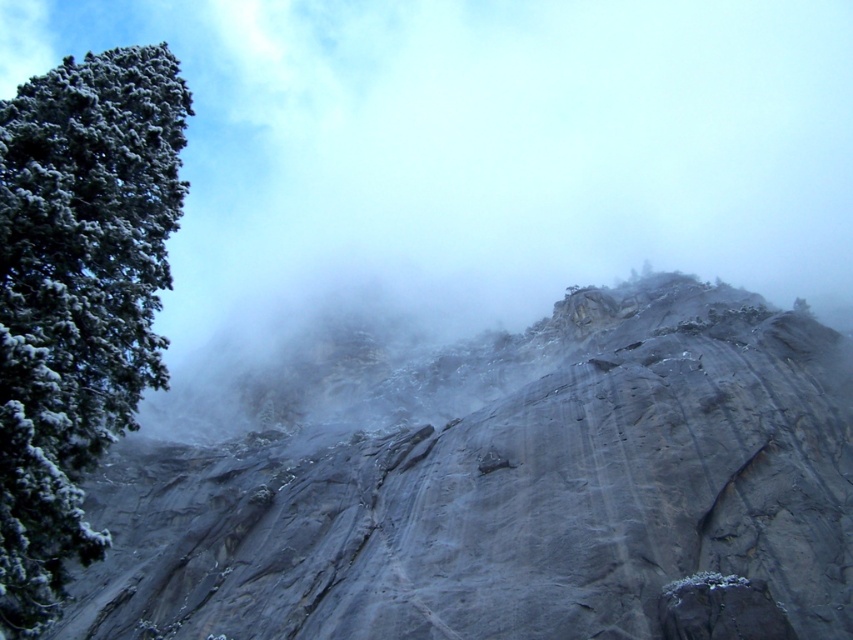
Between gray rough rock at center and green textured tree at left, which one appears on the left side from the viewer's perspective?

green textured tree at left is more to the left.

Does gray rough rock at center have a greater height compared to green textured tree at left?

Yes, gray rough rock at center is taller than green textured tree at left.

Which is in front, point (276, 451) or point (160, 234)?

Point (160, 234) is more forward.

You are a GUI agent. You are given a task and a screenshot of the screen. Output one action in this format:
    pyautogui.click(x=<x>, y=<y>)
    Task: Click on the gray rough rock at center
    
    Given the screenshot: What is the action you would take?
    pyautogui.click(x=485, y=477)